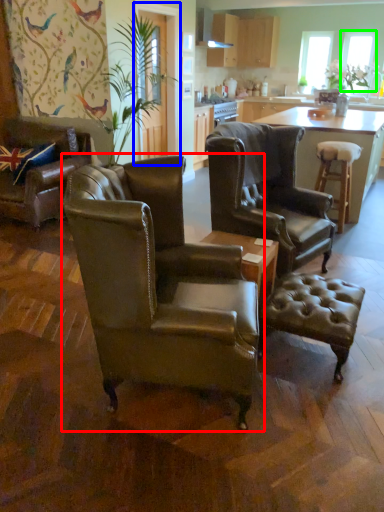
Question: Which object is the closest to the chair (highlighted by a red box)? Choose among these: glass door (highlighted by a blue box) or window screen (highlighted by a green box).

Choices:
 (A) glass door
 (B) window screen

Answer: (A)